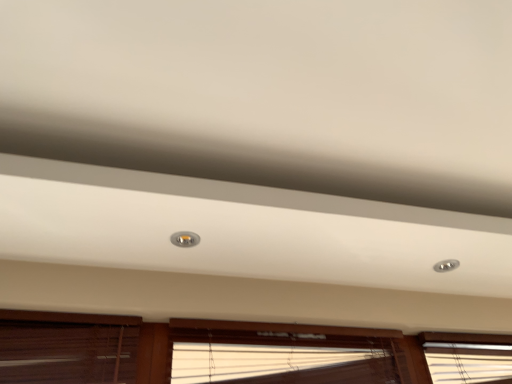
Question: From the image's perspective, is wooden blinds at lower center, placed as the 3th window when sorted from left to right, above or below matte silver droplight at center?

Choices:
 (A) below
 (B) above

Answer: (A)

Question: Considering the relative positions of wooden blinds at lower center, placed as the 3th window when sorted from left to right, and matte silver droplight at center in the image provided, is wooden blinds at lower center, placed as the 3th window when sorted from left to right, to the left or to the right of matte silver droplight at center?

Choices:
 (A) right
 (B) left

Answer: (A)

Question: Estimate the real-world distances between objects in this image. Which object is closer to the brown wood blinds at lower left, positioned as the 3th window in right-to-left order?

Choices:
 (A) matte silver droplight at center
 (B) translucent bamboo blinds at lower center, the 2th window positioned from the left
 (C) wooden blinds at lower center, placed as the 3th window when sorted from left to right

Answer: (C)

Question: Based on their relative distances, which object is farther from the brown wood blinds at lower left, positioned as the 3th window in right-to-left order?

Choices:
 (A) translucent bamboo blinds at lower center, the 2th window positioned from the left
 (B) wooden blinds at lower center, which is the first window from right to left
 (C) matte silver droplight at center

Answer: (C)